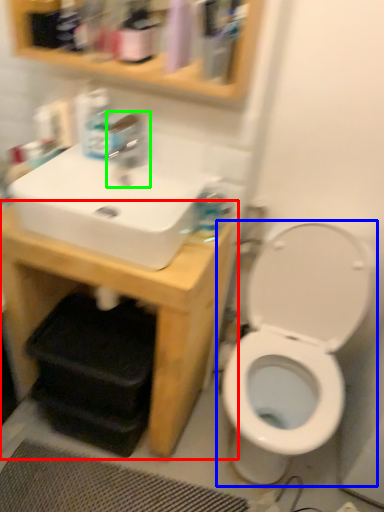
Question: Based on their relative distances, which object is nearer to counter (highlighted by a red box)? Choose from toilet (highlighted by a blue box) and tap (highlighted by a green box).

Choices:
 (A) toilet
 (B) tap

Answer: (A)